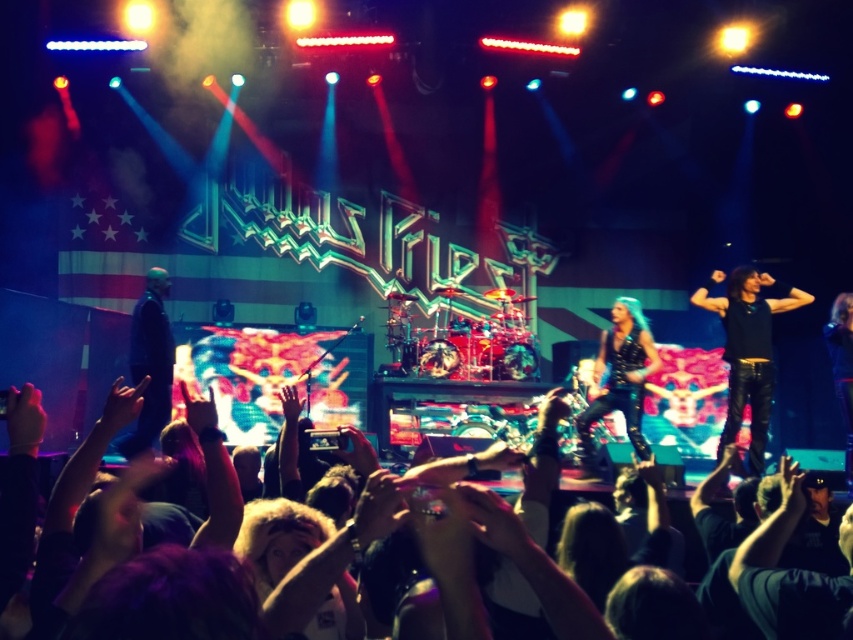
Looking at this image, is black leather pants at right taller than black leather jacket at left?

Correct, black leather pants at right is much taller as black leather jacket at left.

How far apart are black leather pants at right and black leather jacket at left?

15.17 feet

What do you see at coordinates (747, 349) in the screenshot?
I see `black leather pants at right` at bounding box center [747, 349].

Identify the location of black leather pants at right. (747, 349).